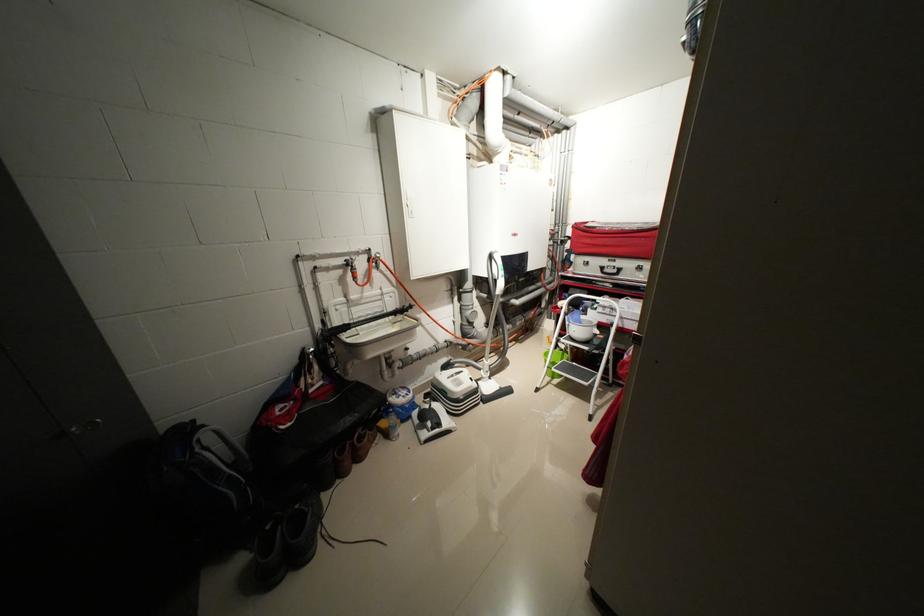
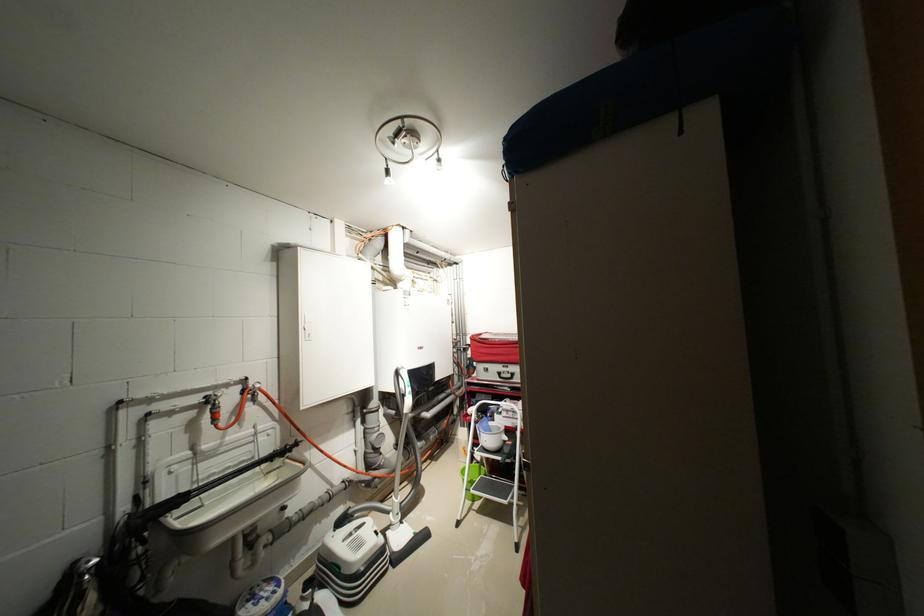
The point at (x=508, y=390) is marked in the first image. Where is the corresponding point in the second image?

(423, 536)